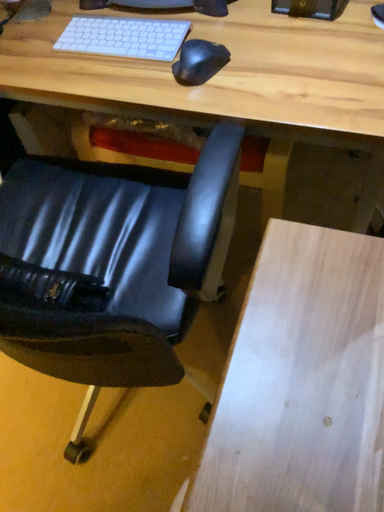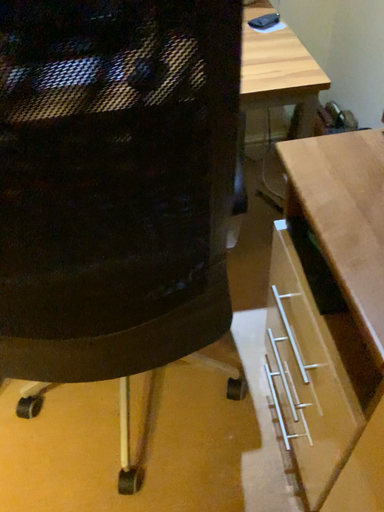
Question: Which way did the camera rotate in the video?

Choices:
 (A) rotated upward
 (B) rotated downward

Answer: (A)